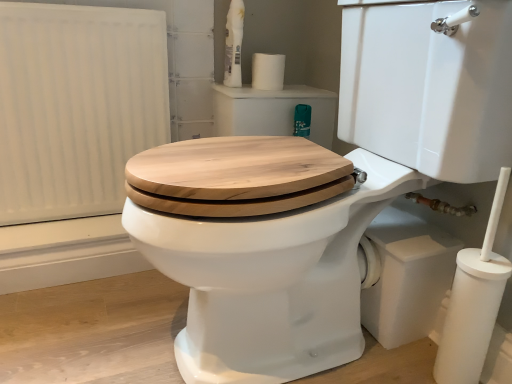
Question: Looking at their shapes, would you say white matte toilet paper at lower right is wider or thinner than white matte toilet paper at upper center?

Choices:
 (A) wide
 (B) thin

Answer: (B)

Question: Based on their positions, is white matte toilet paper at lower right located to the left or right of white matte toilet paper at upper center?

Choices:
 (A) right
 (B) left

Answer: (A)

Question: Based on their relative distances, which object is farther from the white glossy spray bottle at upper center?

Choices:
 (A) white matte radiator at left
 (B) white matte toilet paper at lower right
 (C) white matte toilet paper at upper center

Answer: (B)

Question: Which of these objects is positioned farthest from the white glossy spray bottle at upper center?

Choices:
 (A) white matte toilet paper at lower right
 (B) white matte toilet paper at upper center
 (C) white matte radiator at left

Answer: (A)